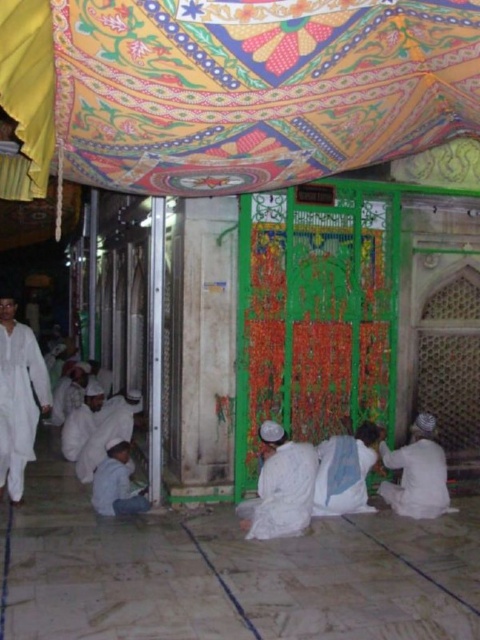
Does white cotton robe at left have a greater height compared to white matte robe at lower right?

Yes, white cotton robe at left is taller than white matte robe at lower right.

Who is positioned more to the left, white cotton robe at left or white matte robe at lower right?

white cotton robe at left is more to the left.

Between point (6, 449) and point (418, 477), which one is positioned in front?

Point (418, 477)

This screenshot has width=480, height=640. What are the coordinates of `white cotton robe at left` in the screenshot? It's located at (20, 403).

Does textured fabric canopy at upper center appear on the left side of white matte robe at lower left?

In fact, textured fabric canopy at upper center is to the right of white matte robe at lower left.

Where is `textured fabric canopy at upper center`? The width and height of the screenshot is (480, 640). textured fabric canopy at upper center is located at coordinates (233, 86).

Does white cotton robe at left appear on the left side of white cotton robe at center?

Indeed, white cotton robe at left is positioned on the left side of white cotton robe at center.

Is white cotton robe at left closer to the viewer compared to white cotton robe at center?

No.

Between point (35, 385) and point (247, 522), which one is positioned in front?

Positioned in front is point (247, 522).

Where is `white cotton robe at left`? This screenshot has width=480, height=640. white cotton robe at left is located at coordinates (20, 403).